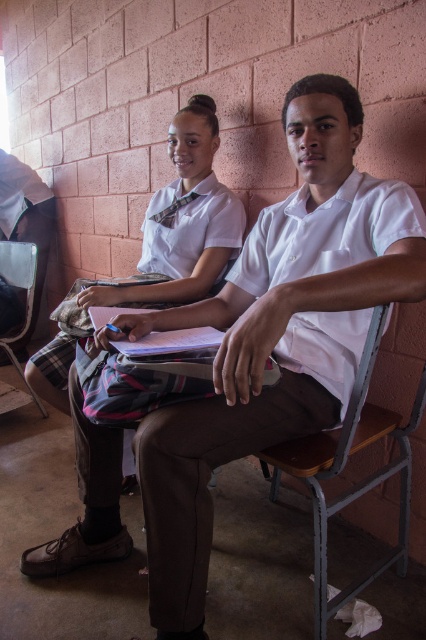
You are a photographer standing in front of the classroom scene. You need to capture a photo where both the wooden seat at lower right and the white glossy shirt at upper center are clearly visible. Based on their positions, which object is located to the right of the other?

The wooden seat at lower right is positioned on the right side of white glossy shirt at upper center, so the wooden seat at lower right is to the right of the white glossy shirt at upper center.

You are standing in a classroom and want to reach a point marked at coordinates point [362,420]. If you can move forward 1.3 meters, will you be able to reach that point?

The distance between point [362,420] and the viewer is 1.37 meters. Since you can move forward 1.3 meters, you will not be able to reach the point as you are 0.07 meters short.

You are a student trying to sit between two classmates who are sitting on the wooden seat at lower right and the metallic gray chair at lower left. How far apart are these two seats?

The wooden seat at lower right and the metallic gray chair at lower left are 1.75 meters apart from each other.